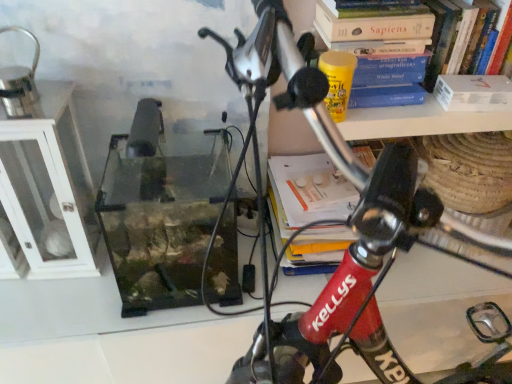
Question: From their relative heights in the image, would you say white matte paperback book at upper right is taller or shorter than white glass cabinet at left?

Choices:
 (A) tall
 (B) short

Answer: (B)

Question: From a real-world perspective, relative to white glass cabinet at left, is white matte paperback book at upper right vertically above or below?

Choices:
 (A) above
 (B) below

Answer: (A)

Question: Which object is the farthest from the white glass cabinet at left?

Choices:
 (A) red matte bicycle handlebar at center
 (B) hardcover book at upper right, which is the second book in left-to-right order
 (C) white matte paperback book at upper right
 (D) hardcover book at upper right, positioned as the 2th book in right-to-left order

Answer: (C)

Question: Estimate the real-world distances between objects in this image. Which object is farther from the red matte bicycle handlebar at center?

Choices:
 (A) white matte paperback book at upper right
 (B) hardcover book at upper right, positioned as the first book in right-to-left order
 (C) white glass cabinet at left
 (D) hardcover book at upper right, which is the first book from left to right

Answer: (B)